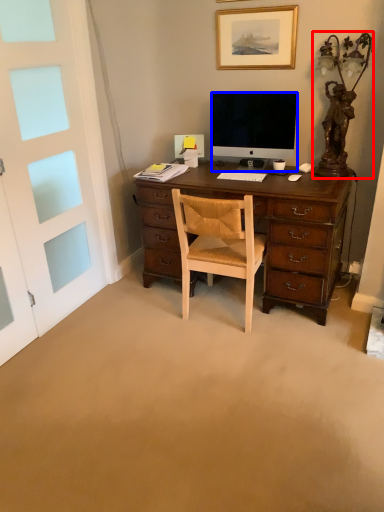
Question: Among these objects, which one is farthest to the camera, table lamp (highlighted by a red box) or television (highlighted by a blue box)?

Choices:
 (A) table lamp
 (B) television

Answer: (B)